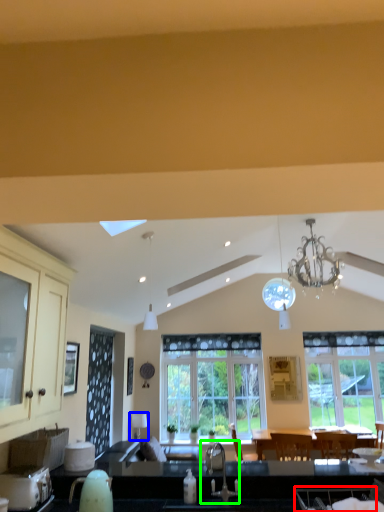
Question: Estimate the real-world distances between objects in this image. Which object is farther from armchair (highlighted by a red box), lamp (highlighted by a blue box) or sink (highlighted by a green box)?

Choices:
 (A) lamp
 (B) sink

Answer: (A)